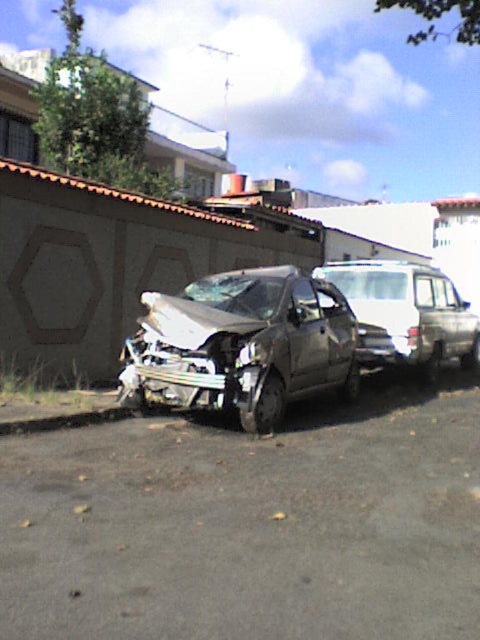
Question: Where is silver metallic car at center located in relation to silver metallic van at center in the image?

Choices:
 (A) right
 (B) left

Answer: (B)

Question: Where is silver metallic car at center located in relation to silver metallic van at center in the image?

Choices:
 (A) left
 (B) right

Answer: (A)

Question: Among these objects, which one is farthest from the camera?

Choices:
 (A) silver metallic van at center
 (B) silver metallic car at center

Answer: (A)

Question: Which object appears farthest from the camera in this image?

Choices:
 (A) silver metallic van at center
 (B) silver metallic car at center

Answer: (A)

Question: Does silver metallic car at center have a larger size compared to silver metallic van at center?

Choices:
 (A) no
 (B) yes

Answer: (B)

Question: Which object appears farthest from the camera in this image?

Choices:
 (A) silver metallic van at center
 (B) silver metallic car at center

Answer: (A)